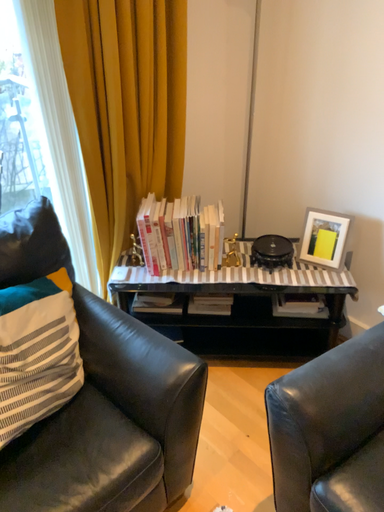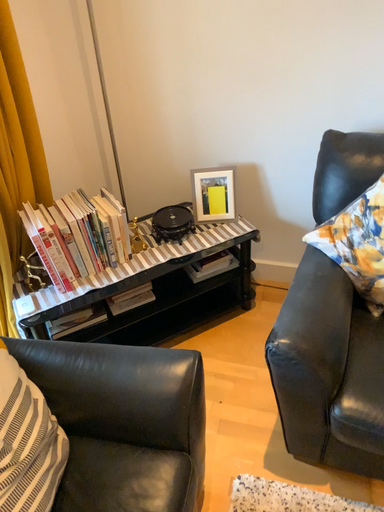
Question: Which way did the camera rotate in the video?

Choices:
 (A) rotated right
 (B) rotated left

Answer: (A)